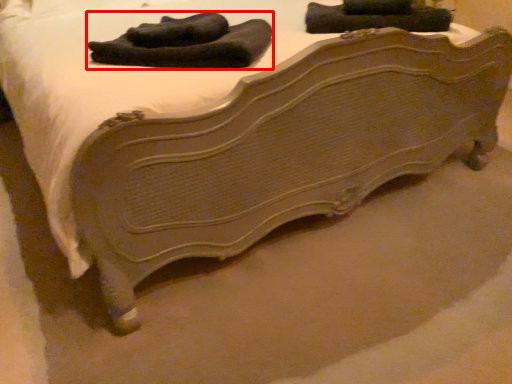
Question: Observing the image, what is the correct spatial positioning of laundry (annotated by the red box) in reference to clothing?

Choices:
 (A) left
 (B) right

Answer: (A)